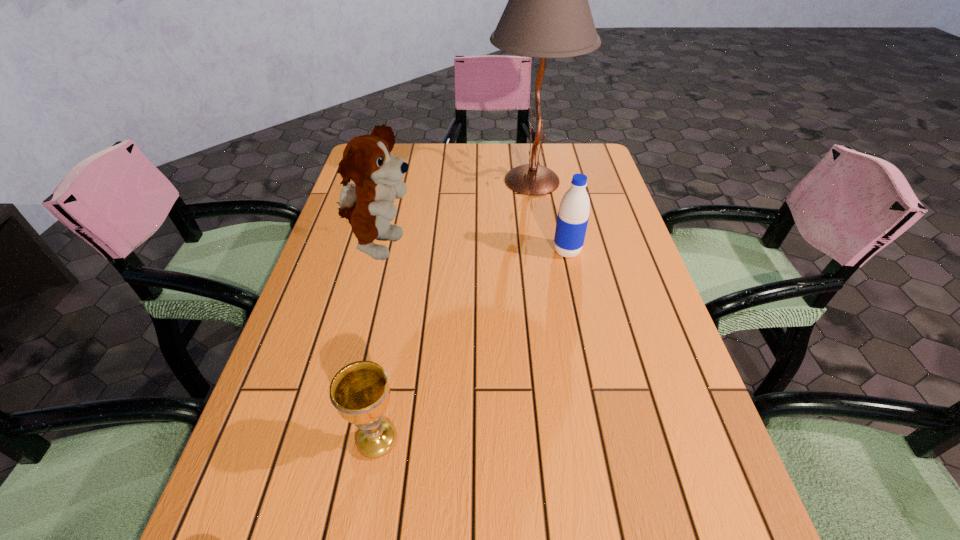
The width and height of the screenshot is (960, 540). In order to click on free space at the far left corner in this screenshot , I will do `click(401, 145)`.

Where is `free spot at the far right corner of the desktop`? The width and height of the screenshot is (960, 540). free spot at the far right corner of the desktop is located at coordinates (594, 160).

At what (x,y) coordinates should I click in order to perform the action: click on free space between the tallest object and the shortest object. Please return your answer as a coordinate pair (x, y). Image resolution: width=960 pixels, height=540 pixels. Looking at the image, I should click on (454, 310).

I want to click on vacant area between the water bottle and the puppy, so click(473, 249).

At what (x,y) coordinates should I click in order to perform the action: click on unoccupied area between the table lamp and the water bottle. Please return your answer as a coordinate pair (x, y). The height and width of the screenshot is (540, 960). Looking at the image, I should click on (549, 216).

At what (x,y) coordinates should I click in order to perform the action: click on empty location between the water bottle and the tallest object. Please return your answer as a coordinate pair (x, y). Looking at the image, I should click on 549,216.

Where is `free space that is in between the water bottle and the third shortest object`? free space that is in between the water bottle and the third shortest object is located at coordinates (473, 249).

Where is `vacant region between the third shortest object and the third tallest object`? vacant region between the third shortest object and the third tallest object is located at coordinates (473, 249).

You are a GUI agent. You are given a task and a screenshot of the screen. Output one action in this format:
    pyautogui.click(x=<x>, y=<y>)
    Task: Click on the vacant space that's between the second shortest object and the second tallest object
    The height and width of the screenshot is (540, 960).
    Given the screenshot: What is the action you would take?
    pyautogui.click(x=473, y=249)

You are a GUI agent. You are given a task and a screenshot of the screen. Output one action in this format:
    pyautogui.click(x=<x>, y=<y>)
    Task: Click on the object that is the closest one to the third tallest object
    
    Given the screenshot: What is the action you would take?
    pyautogui.click(x=548, y=15)